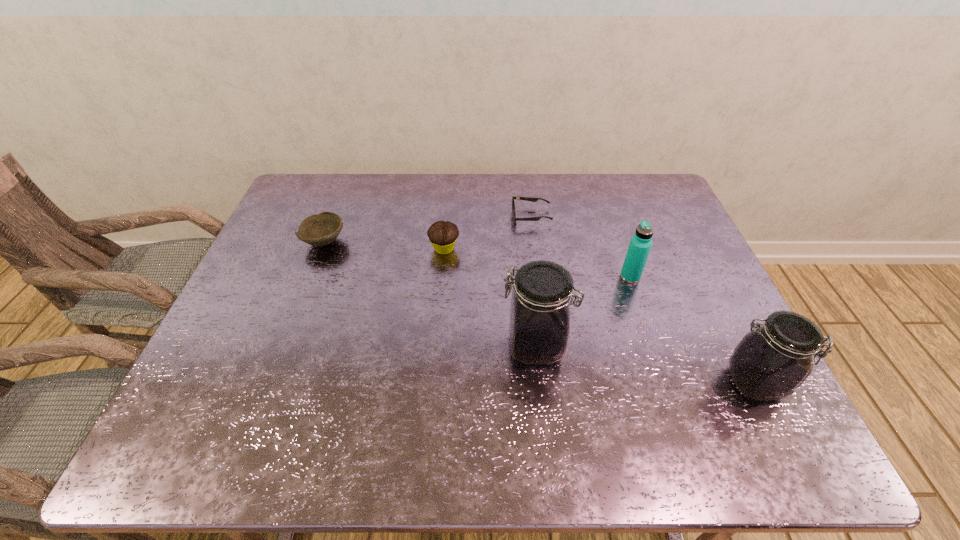
This screenshot has width=960, height=540. I want to click on the third shortest object, so click(x=442, y=234).

At what (x,y) coordinates should I click in order to perform the action: click on muffin. Please return your answer as a coordinate pair (x, y). Looking at the image, I should click on (442, 234).

Find the location of a particular element. This screenshot has height=540, width=960. free spot located on the lid of the tallest object is located at coordinates 396,346.

Identify the location of free point located on the lid of the tallest object. (384, 346).

At what (x,y) coordinates should I click in order to perform the action: click on vacant position located on the lid of the tallest object. Please return your answer as a coordinate pair (x, y). Looking at the image, I should click on (363, 346).

Locate an element on the screen. The height and width of the screenshot is (540, 960). vacant space situated on the back of the fourth farthest object is located at coordinates (608, 212).

The image size is (960, 540). What are the coordinates of `free space located on the front-facing side of the sunglasses` in the screenshot? It's located at click(x=443, y=216).

This screenshot has width=960, height=540. I want to click on blank space located 0.380m on the front-facing side of the sunglasses, so click(x=393, y=216).

Locate an element on the screen. The height and width of the screenshot is (540, 960). free point located 0.270m on the front-facing side of the sunglasses is located at coordinates (427, 216).

Where is `vacant region located on the front of the leftmost object`? The width and height of the screenshot is (960, 540). vacant region located on the front of the leftmost object is located at coordinates (280, 357).